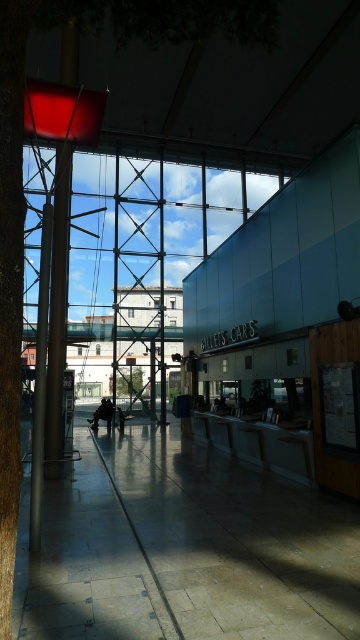
You are a traveler carrying a heavy bag and need to reach the dark gray fabric jacket at center. There is a polished silver pole at left in your path. Can you walk straight towards the jacket without moving around the pole?

The polished silver pole at left is closer to the viewer than dark gray fabric jacket at center, so you must navigate around the pole to reach the jacket as it is blocking your direct path.

You are standing in the transportation hub and want to take a shortcut to the exit located at the far end of the polished concrete floor at center. To avoid walking around the green leafy tree at center, can you walk directly through the space between them?

The polished concrete floor at center is to the right of green leafy tree at center, so you cannot walk directly between them since they are positioned side by side rather than in a straight path.

You are standing in the transportation hub and see both the green leafy tree at center and the dark gray fabric jacket at center. Which object is positioned to the right when facing the scene?

The green leafy tree at center is positioned to the right of the dark gray fabric jacket at center.